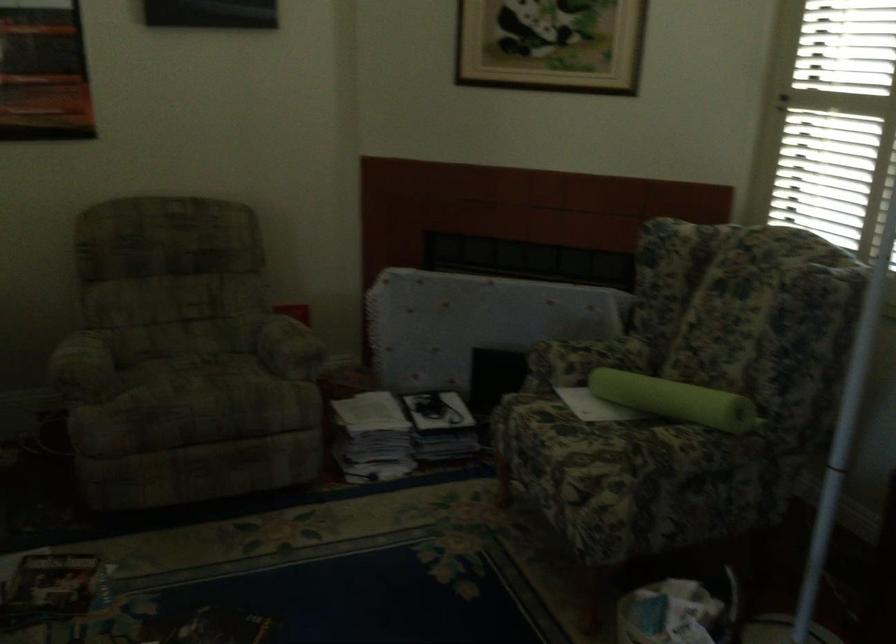
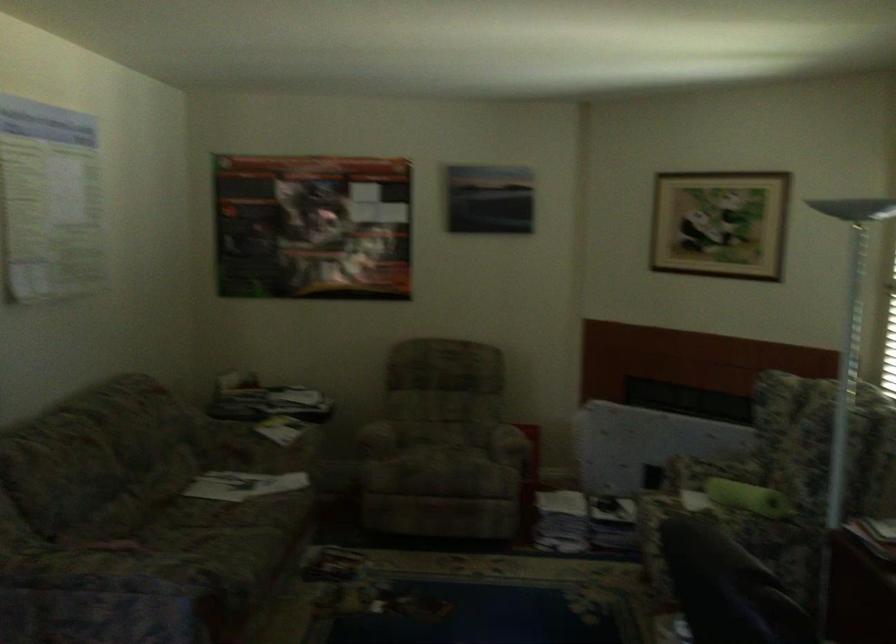
Locate, in the second image, the point that corresponds to (x=268, y=315) in the first image.

(506, 424)